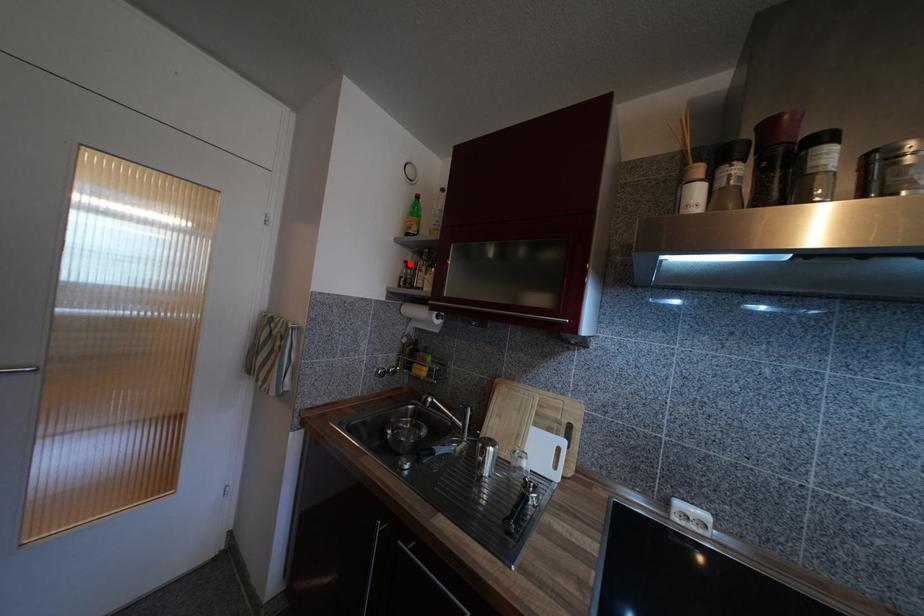
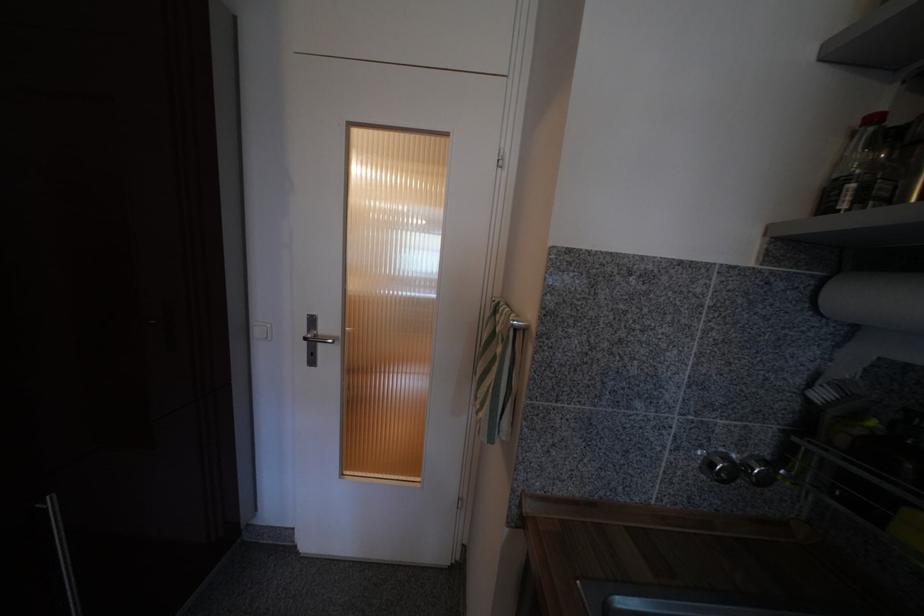
The point at the highlighted location is marked in the first image. Where is the corresponding point in the second image?

(879, 121)